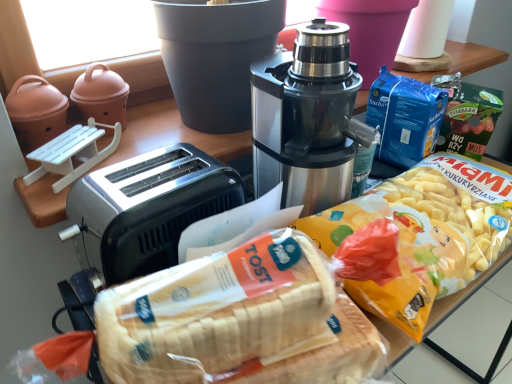
Question: Considering the relative sizes of matte ceramic pot at upper left and white bread at center in the image provided, is matte ceramic pot at upper left bigger than white bread at center?

Choices:
 (A) yes
 (B) no

Answer: (B)

Question: From a real-world perspective, is matte ceramic pot at upper left on top of white bread at center?

Choices:
 (A) no
 (B) yes

Answer: (B)

Question: Does matte ceramic pot at upper left appear on the left side of white bread at center?

Choices:
 (A) yes
 (B) no

Answer: (A)

Question: Does matte ceramic pot at upper left have a lesser height compared to white bread at center?

Choices:
 (A) yes
 (B) no

Answer: (B)

Question: Is matte ceramic pot at upper left positioned before white bread at center?

Choices:
 (A) no
 (B) yes

Answer: (A)

Question: Is matte ceramic pot at upper left facing towards white bread at center?

Choices:
 (A) yes
 (B) no

Answer: (A)

Question: From the image's perspective, is satin silver toaster at left beneath white bread at center?

Choices:
 (A) no
 (B) yes

Answer: (A)

Question: Is satin silver toaster at left aimed at white bread at center?

Choices:
 (A) yes
 (B) no

Answer: (A)

Question: From a real-world perspective, is satin silver toaster at left located beneath white bread at center?

Choices:
 (A) no
 (B) yes

Answer: (B)

Question: Considering the relative positions of satin silver toaster at left and white bread at center in the image provided, is satin silver toaster at left to the right of white bread at center from the viewer's perspective?

Choices:
 (A) yes
 (B) no

Answer: (B)

Question: Can you confirm if satin silver toaster at left is shorter than white bread at center?

Choices:
 (A) yes
 (B) no

Answer: (B)

Question: Does satin silver toaster at left have a lesser width compared to white bread at center?

Choices:
 (A) yes
 (B) no

Answer: (B)

Question: Is matte ceramic pot at upper left at the left side of satin black coffee maker at center?

Choices:
 (A) yes
 (B) no

Answer: (A)